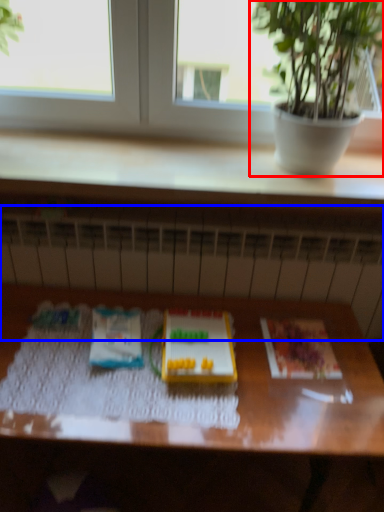
Question: Which object is closer to the camera taking this photo, houseplant (highlighted by a red box) or radiator (highlighted by a blue box)?

Choices:
 (A) houseplant
 (B) radiator

Answer: (A)